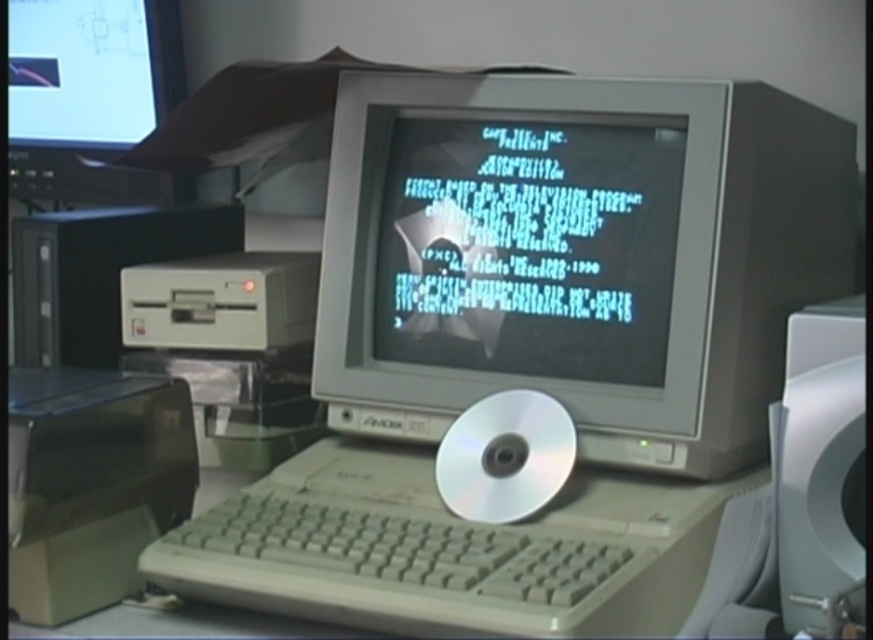
You are setting up a desk and want to place both the matte plastic monitor at center and the white plastic speaker at right. Based on the image, which object should be placed on the left side of the desk?

The matte plastic monitor at center should be placed on the left side of the desk because it is positioned to the left of the white plastic speaker at right in the image.

You are setting up a desk for a retro computing exhibit. You have a matte plastic monitor at center and a white plastic keyboard at center. Which object has a smaller width?

The matte plastic monitor at center has a smaller width compared to the white plastic keyboard at center.

Based on the photo, you are setting up a desk and need to place both the matte plastic monitor at center and the matte black monitor at upper left. Given their sizes, which one should you place first to ensure they both fit on the desk?

You should place the matte black monitor at upper left first because it occupies more space than the matte plastic monitor at center, ensuring there is enough room for both.